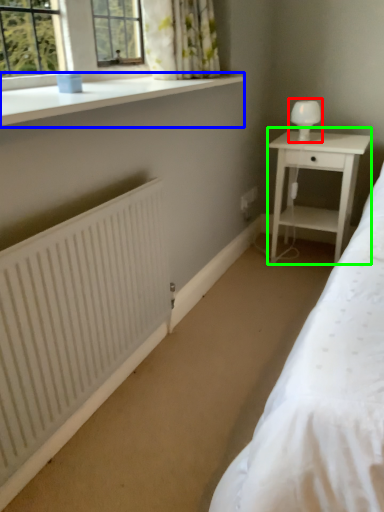
Question: Which is nearer to the table lamp (highlighted by a red box)? window sill (highlighted by a blue box) or nightstand (highlighted by a green box).

Choices:
 (A) window sill
 (B) nightstand

Answer: (B)